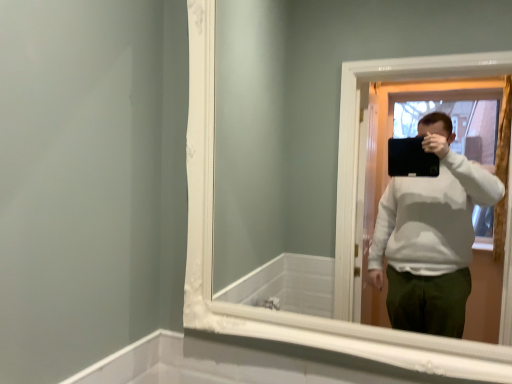
What do you see at coordinates (307, 108) in the screenshot? The image size is (512, 384). I see `white glossy mirror at center` at bounding box center [307, 108].

Locate an element on the screen. The height and width of the screenshot is (384, 512). white glossy mirror at center is located at coordinates [x=307, y=108].

The width and height of the screenshot is (512, 384). Identify the location of white glossy mirror at center. 307,108.